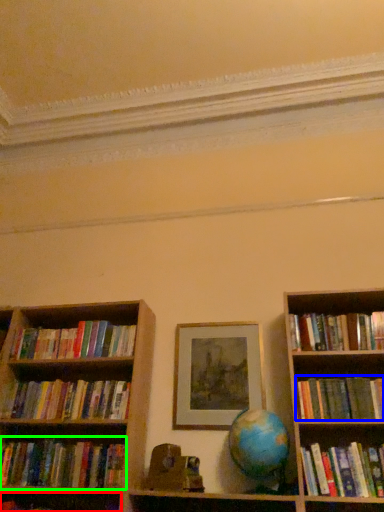
Question: Which object is positioned closest to book (highlighted by a red box)? Select from book (highlighted by a blue box) and book (highlighted by a green box).

Choices:
 (A) book
 (B) book

Answer: (B)